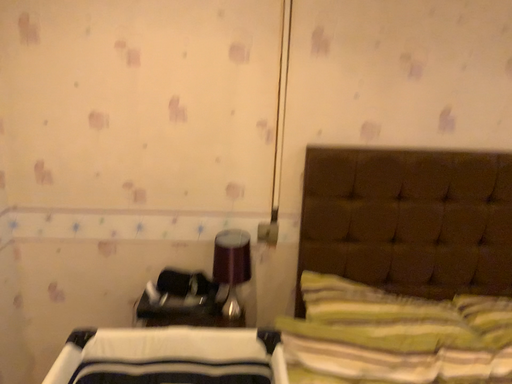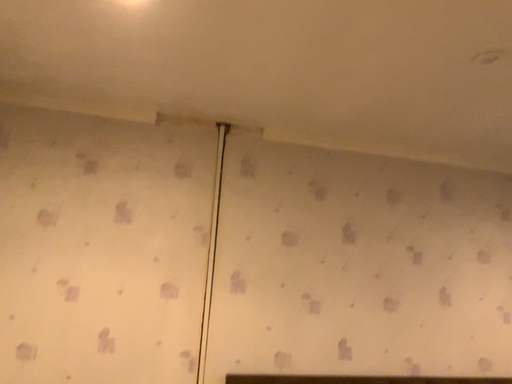
Question: How did the camera likely rotate when shooting the video?

Choices:
 (A) rotated upward
 (B) rotated downward

Answer: (A)